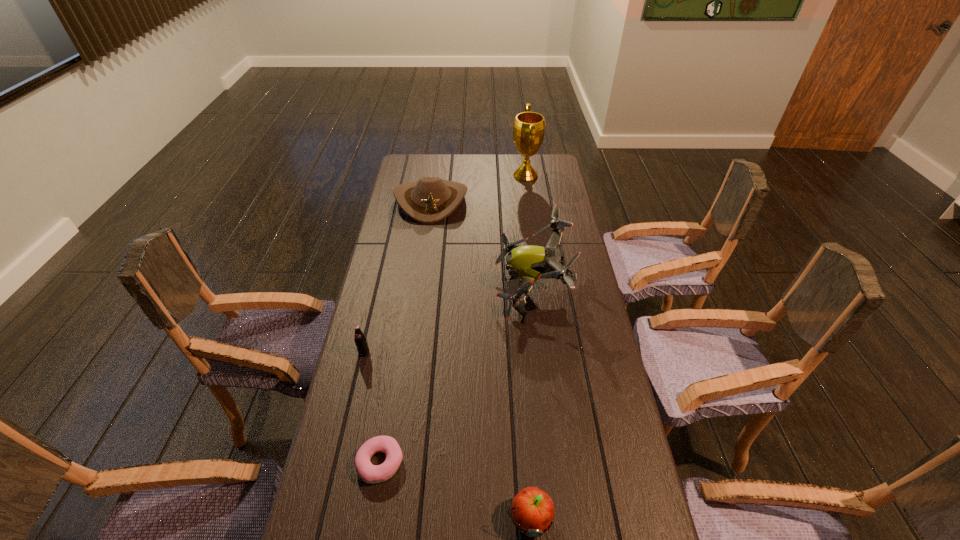
Locate an element on the screen. The width and height of the screenshot is (960, 540). the tallest object is located at coordinates (529, 127).

What are the coordinates of `drone` in the screenshot? It's located at (529, 263).

Locate an element on the screen. This screenshot has width=960, height=540. the fourth nearest object is located at coordinates (529, 263).

The height and width of the screenshot is (540, 960). What are the coordinates of `cowboy hat` in the screenshot? It's located at (430, 200).

The width and height of the screenshot is (960, 540). What are the coordinates of `pop` in the screenshot? It's located at (360, 340).

Where is `the fifth farthest object`? The height and width of the screenshot is (540, 960). the fifth farthest object is located at coordinates click(370, 473).

Image resolution: width=960 pixels, height=540 pixels. I want to click on pastry, so click(370, 473).

Where is `vacant position located 0.220m on the front-facing side of the tallest object`? The image size is (960, 540). vacant position located 0.220m on the front-facing side of the tallest object is located at coordinates (464, 176).

This screenshot has width=960, height=540. Find the location of `vacant space situated on the front-facing side of the tallest object`. vacant space situated on the front-facing side of the tallest object is located at coordinates (478, 176).

Where is `vacant space located on the front-facing side of the tallest object`? Image resolution: width=960 pixels, height=540 pixels. vacant space located on the front-facing side of the tallest object is located at coordinates (487, 176).